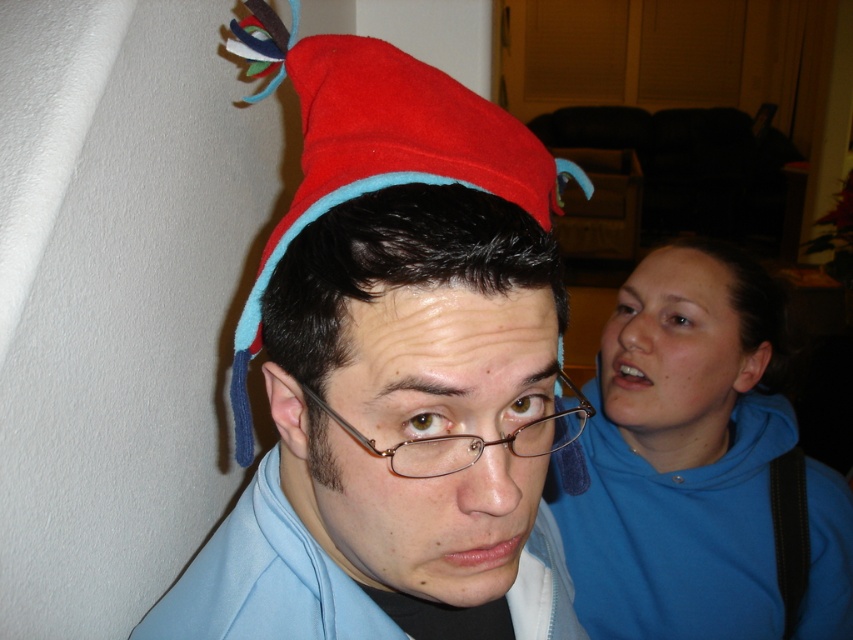
You are an interior designer assessing the spatial arrangement of the room. You notice the blue fleece sweatshirt at upper right and the red felt hat at center. Which object occupies a higher vertical position in the image?

The blue fleece sweatshirt at upper right is much taller than the red felt hat at center, so it occupies a higher vertical position.

You are standing in the room and want to place a small decoration exactly at the center of the room. Is the red felt hat at center currently blocking that spot?

The red felt hat at center is located at point (376,147), which is not the exact center of the room, so it is not blocking the center spot.